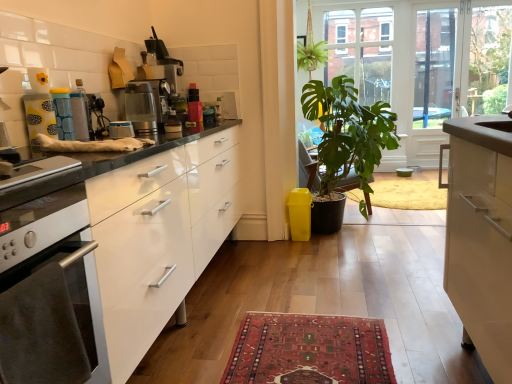
The width and height of the screenshot is (512, 384). Identify the location of unoccupied region to the right of yellow plastic trash bin/can at lower right. (327, 235).